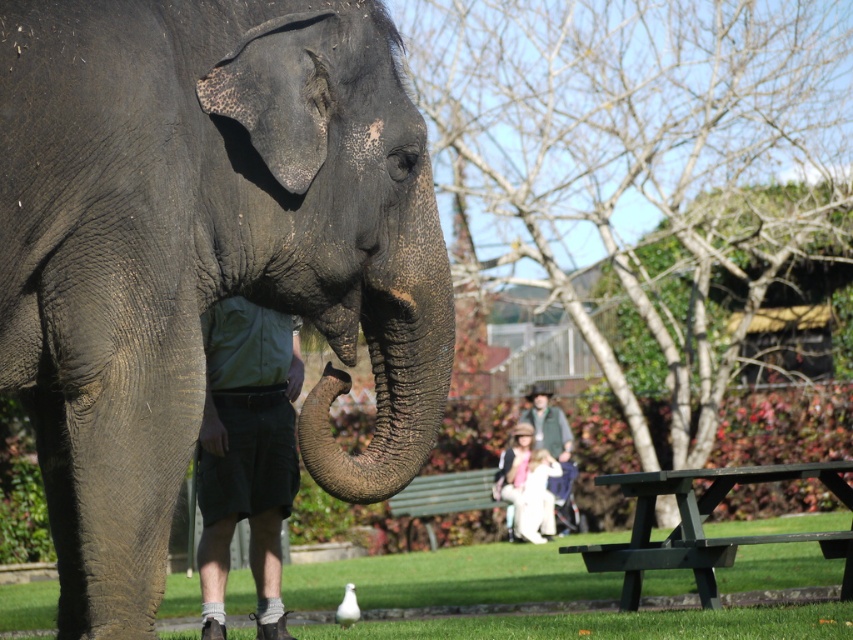
Looking at this image, is green grass at lower center thinner than green fabric jacket at center?

In fact, green grass at lower center might be wider than green fabric jacket at center.

Which is above, green grass at lower center or green fabric jacket at center?

Positioned higher is green fabric jacket at center.

Who is more forward, (x=404, y=557) or (x=550, y=419)?

Point (x=404, y=557)

In order to click on green grass at lower center in this screenshot , I will do `click(456, 577)`.

Which of these two, dark gray wrinkled skin elephant at center or green wooden bench at lower center, stands shorter?

With less height is green wooden bench at lower center.

In the scene shown: Does dark gray wrinkled skin elephant at center come in front of green wooden bench at lower center?

Yes, dark gray wrinkled skin elephant at center is in front of green wooden bench at lower center.

At what (x,y) coordinates should I click in order to perform the action: click on dark gray wrinkled skin elephant at center. Please return your answer as a coordinate pair (x, y). Image resolution: width=853 pixels, height=640 pixels. Looking at the image, I should click on (202, 252).

Between point (642, 528) and point (544, 404), which one is positioned behind?

Positioned behind is point (544, 404).

Does green wood picnic table at lower right have a larger size compared to green fabric jacket at center?

No, green wood picnic table at lower right is not bigger than green fabric jacket at center.

Is point (718, 552) less distant than point (543, 392)?

That is True.

Identify the location of green wood picnic table at lower right. Image resolution: width=853 pixels, height=640 pixels. (701, 525).